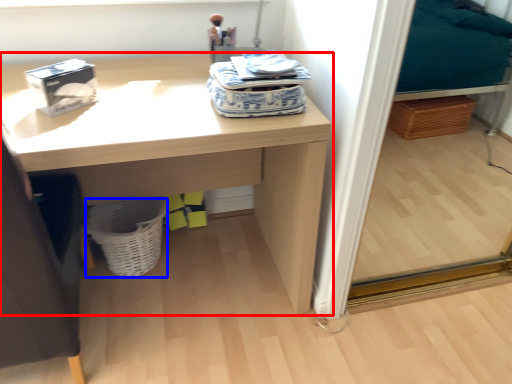
Question: Which object is closer to the camera taking this photo, desk (highlighted by a red box) or basket (highlighted by a blue box)?

Choices:
 (A) desk
 (B) basket

Answer: (A)